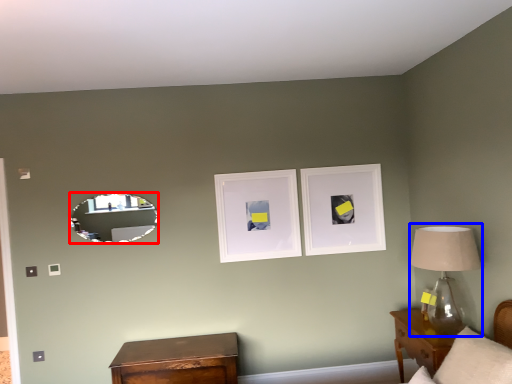
Question: Which object appears farthest to the camera in this image, mirror (highlighted by a red box) or table lamp (highlighted by a blue box)?

Choices:
 (A) mirror
 (B) table lamp

Answer: (A)